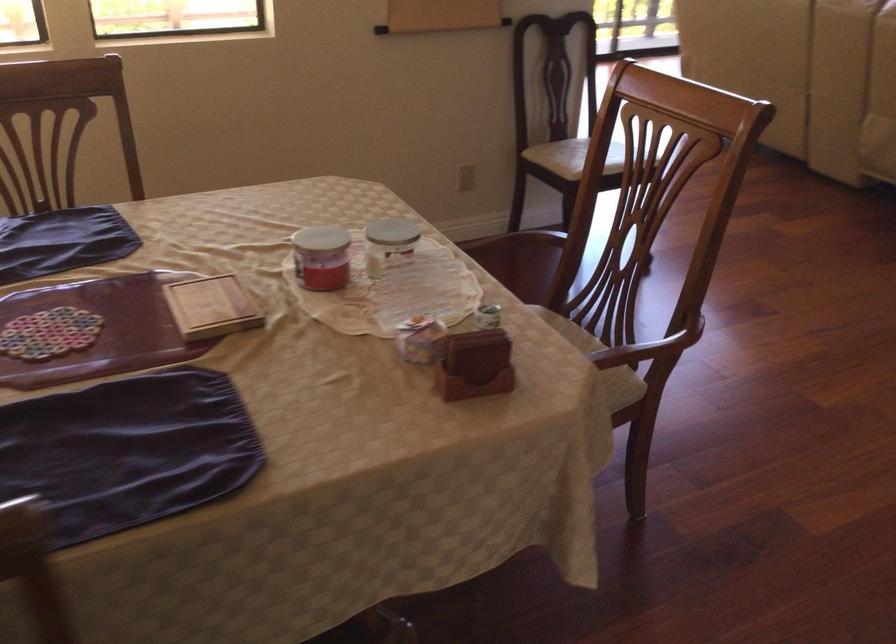
At what (x,y) coordinates should I click in order to perform the action: click on wooden coaster holder. Please return your answer as a coordinate pair (x, y). The height and width of the screenshot is (644, 896). Looking at the image, I should click on (475, 365).